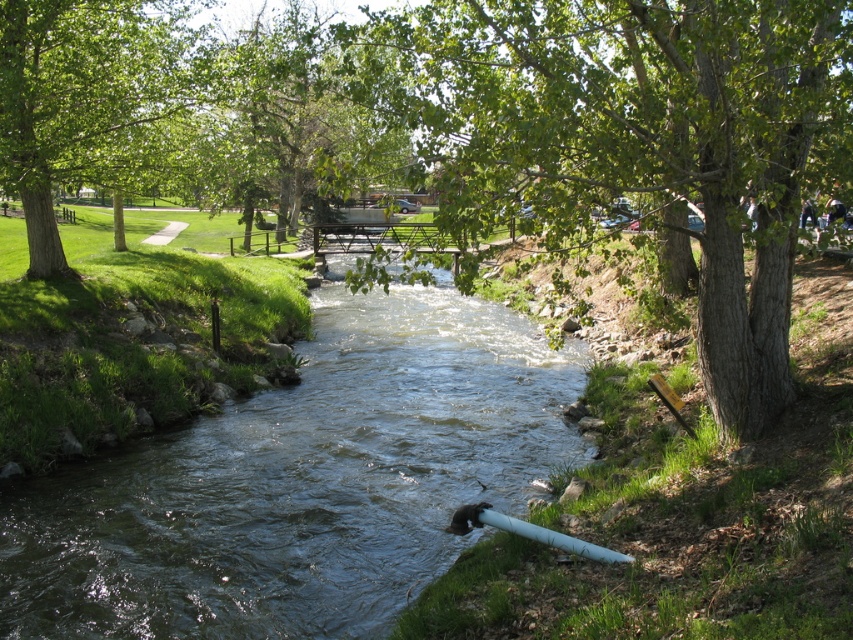
Based on the photo, is clear water at center further to the viewer compared to green leafy tree at center?

Yes, it is behind green leafy tree at center.

Based on the photo, between clear water at center and green leafy tree at center, which one is positioned lower?

clear water at center is below.

Who is more distant from viewer, (236,474) or (550,88)?

A: Point (236,474)

Locate an element on the screen. The height and width of the screenshot is (640, 853). clear water at center is located at coordinates (300, 483).

Which of these two, clear water at center or green leafy tree at upper left, stands taller?

Standing taller between the two is green leafy tree at upper left.

Does clear water at center appear over green leafy tree at upper left?

No, clear water at center is not above green leafy tree at upper left.

At what (x,y) coordinates should I click in order to perform the action: click on clear water at center. Please return your answer as a coordinate pair (x, y). The height and width of the screenshot is (640, 853). Looking at the image, I should click on (300, 483).

Which is in front, point (831, 36) or point (21, 188)?

Positioned in front is point (831, 36).

Who is more distant from viewer, (393, 116) or (25, 182)?

The point (25, 182) is behind.

This screenshot has height=640, width=853. I want to click on green leafy tree at center, so click(634, 140).